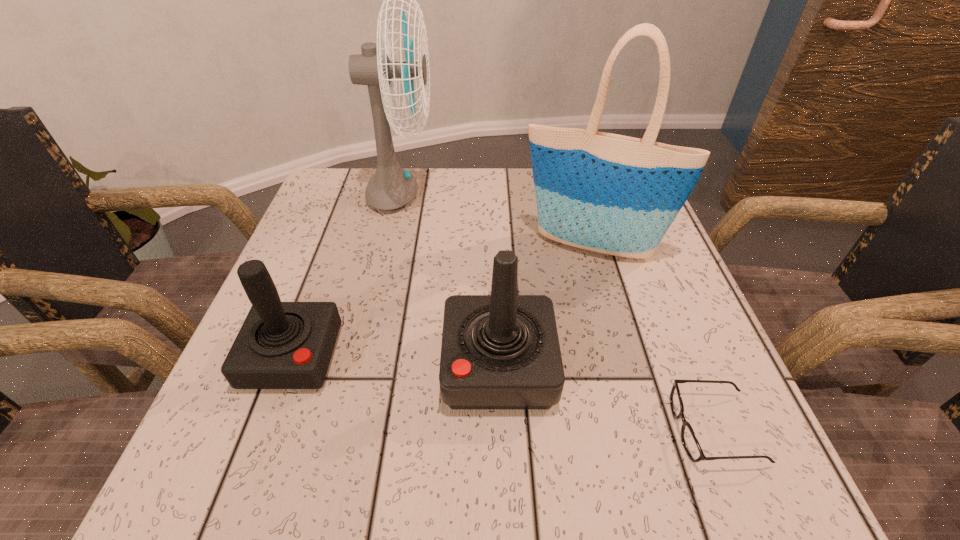
Where is `fan`? Image resolution: width=960 pixels, height=540 pixels. fan is located at coordinates (391, 187).

The width and height of the screenshot is (960, 540). What are the coordinates of `tote bag` in the screenshot? It's located at (608, 193).

Locate an element on the screen. the third shortest object is located at coordinates (501, 351).

I want to click on the taller joystick, so tap(501, 351).

Image resolution: width=960 pixels, height=540 pixels. Identify the location of the shorter joystick. (281, 345).

The image size is (960, 540). I want to click on the second shortest object, so click(x=281, y=345).

The height and width of the screenshot is (540, 960). I want to click on the shortest object, so click(689, 440).

Where is `free region located 0.280m on the front-facing side of the fan`? free region located 0.280m on the front-facing side of the fan is located at coordinates (550, 196).

Locate an element on the screen. free space located on the left of the tote bag is located at coordinates (433, 246).

This screenshot has height=540, width=960. I want to click on vacant space located on the front-facing side of the right joystick, so click(x=256, y=366).